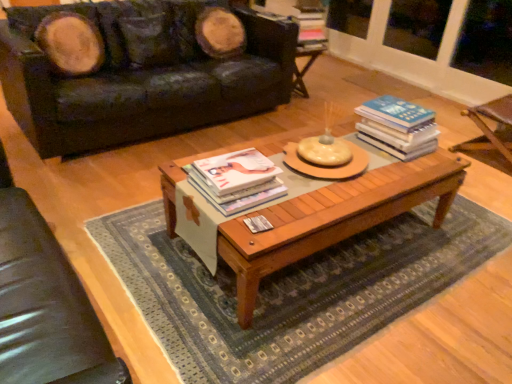
The height and width of the screenshot is (384, 512). Identify the location of vacant area located to the right-hand side of matte white book at center, the first book when ordered from left to right. click(305, 196).